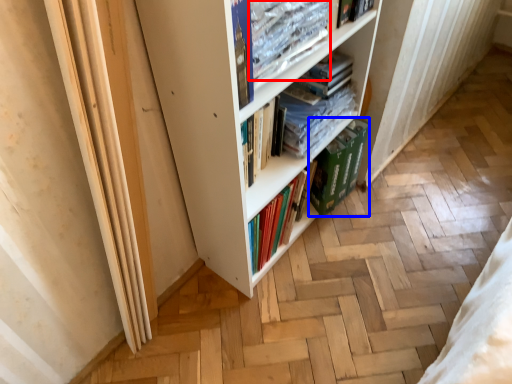
Question: Which object is further to the camera taking this photo, book (highlighted by a red box) or paperback book (highlighted by a blue box)?

Choices:
 (A) book
 (B) paperback book

Answer: (B)